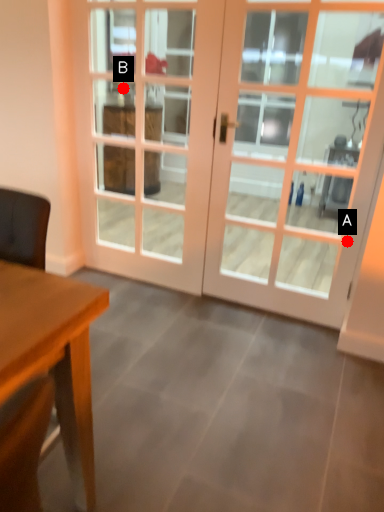
Question: Two points are circled on the image, labeled by A and B beside each circle. Among these points, which one is farthest from the camera?

Choices:
 (A) A is further
 (B) B is further

Answer: (B)